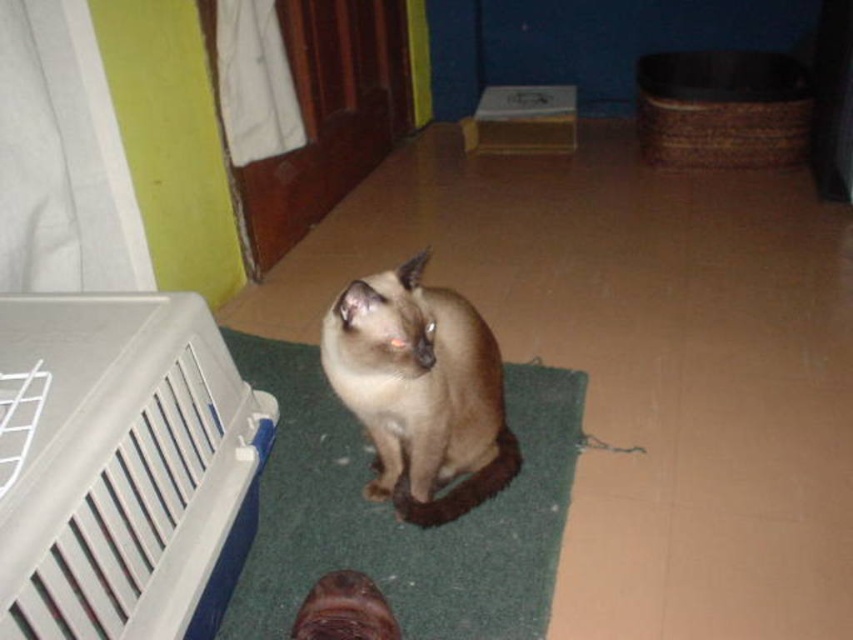
Is the position of green carpet at center more distant than that of smokey brown fur cat at center?

Yes, green carpet at center is behind smokey brown fur cat at center.

Who is more distant from viewer, (550, 561) or (392, 490)?

Point (392, 490)

Does point (529, 380) come closer to viewer compared to point (415, 492)?

That is False.

Identify the location of green carpet at center. (393, 515).

Is white plastic laundry basket at lower left behind smokey brown fur cat at center?

No, it is not.

Is point (68, 401) farther from viewer compared to point (498, 465)?

No.

Find the location of a particular element. This screenshot has width=853, height=640. white plastic laundry basket at lower left is located at coordinates (122, 467).

Who is taller, white plastic laundry basket at lower left or green carpet at center?

white plastic laundry basket at lower left is taller.

Can you confirm if white plastic laundry basket at lower left is smaller than green carpet at center?

Yes.

Measure the distance between point [210,636] and camera.

A distance of 1.21 meters exists between point [210,636] and camera.

Find the location of a particular element. The width and height of the screenshot is (853, 640). white plastic laundry basket at lower left is located at coordinates (122, 467).